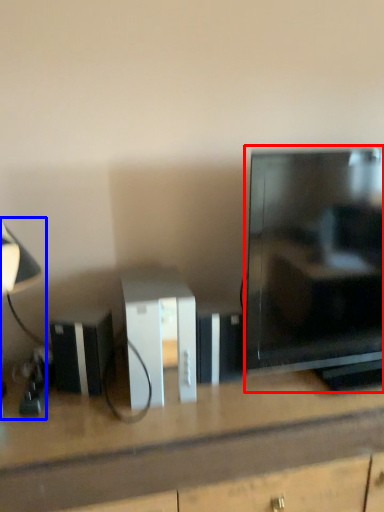
Question: Which object is closer to the camera taking this photo, television (highlighted by a red box) or table lamp (highlighted by a blue box)?

Choices:
 (A) television
 (B) table lamp

Answer: (B)